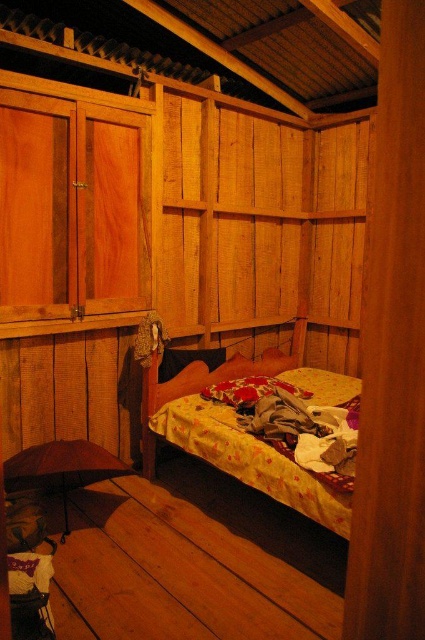
You are standing in the cabin and need to place a new red pillow exactly at the center of the bed. The bed is covered with a yellow floral bedspread. Where should you place the new red pillow in relation to the fluffy fabric pillow at center?

The fluffy fabric pillow at center is already at the center of the bed, so you should place the new red pillow in the same location as the fluffy fabric pillow at center.

You are organizing items in the cabin and need to place a new item between the yellow floral fabric bed at center and the black fabric pillow at center. Based on their positions, which object should you place the item closer to if you want it to be on the left side of the cabin?

Since the yellow floral fabric bed at center is to the right of the black fabric pillow at center, placing the item closer to the black fabric pillow at center would position it on the left side of the cabin.